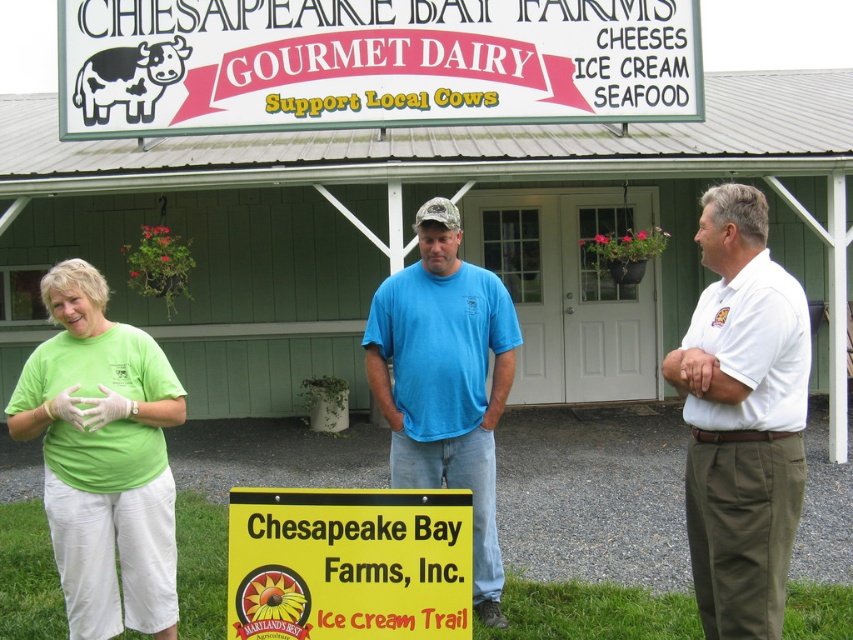
Is white cotton shirt at center to the left of green matte t-shirt at center from the viewer's perspective?

In fact, white cotton shirt at center is to the right of green matte t-shirt at center.

Who is lower down, white cotton shirt at center or green matte t-shirt at center?

green matte t-shirt at center is below.

What do you see at coordinates (741, 419) in the screenshot? I see `white cotton shirt at center` at bounding box center [741, 419].

Find the location of a particular element. This screenshot has height=640, width=853. white cotton shirt at center is located at coordinates (741, 419).

Does white plastic sign at upper center appear on the left side of white cotton shirt at center?

Yes, white plastic sign at upper center is to the left of white cotton shirt at center.

Measure the distance from white plastic sign at upper center to white cotton shirt at center.

The distance of white plastic sign at upper center from white cotton shirt at center is 16.88 feet.

Describe the element at coordinates (370, 64) in the screenshot. Image resolution: width=853 pixels, height=640 pixels. I see `white plastic sign at upper center` at that location.

The height and width of the screenshot is (640, 853). I want to click on white plastic sign at upper center, so click(x=370, y=64).

Who is more distant from viewer, (741,579) or (422,605)?

Positioned behind is point (741,579).

Is point (761, 387) less distant than point (292, 516)?

Yes.

Who is more distant from viewer, (779, 385) or (349, 552)?

Positioned behind is point (349, 552).

Locate an element on the screen. The width and height of the screenshot is (853, 640). white cotton shirt at center is located at coordinates (741, 419).